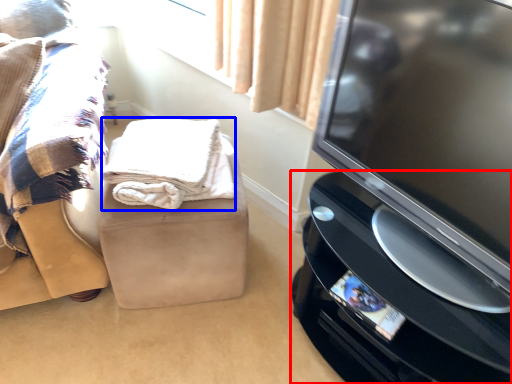
Question: Which of the following is the closest to the observer, home appliance (highlighted by a red box) or blanket (highlighted by a blue box)?

Choices:
 (A) home appliance
 (B) blanket

Answer: (A)